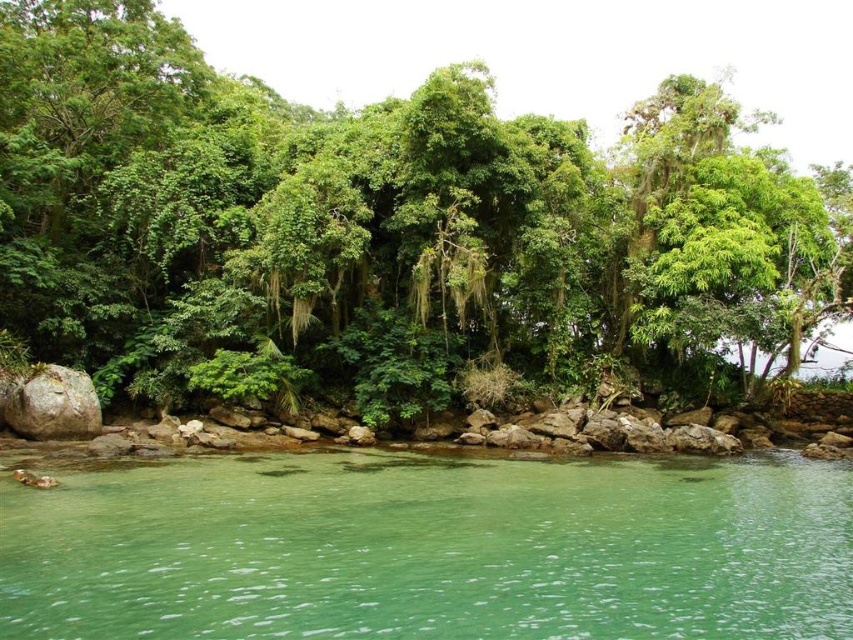
From the picture: Which of these two, green leafy tree at center or green translucent water at lower center, stands shorter?

green translucent water at lower center

From the picture: Does green leafy tree at center have a greater height compared to green translucent water at lower center?

Correct, green leafy tree at center is much taller as green translucent water at lower center.

Based on the photo, measure the distance between green leafy tree at center and camera.

green leafy tree at center and camera are 36.19 meters apart from each other.

Locate an element on the screen. The height and width of the screenshot is (640, 853). green leafy tree at center is located at coordinates (390, 227).